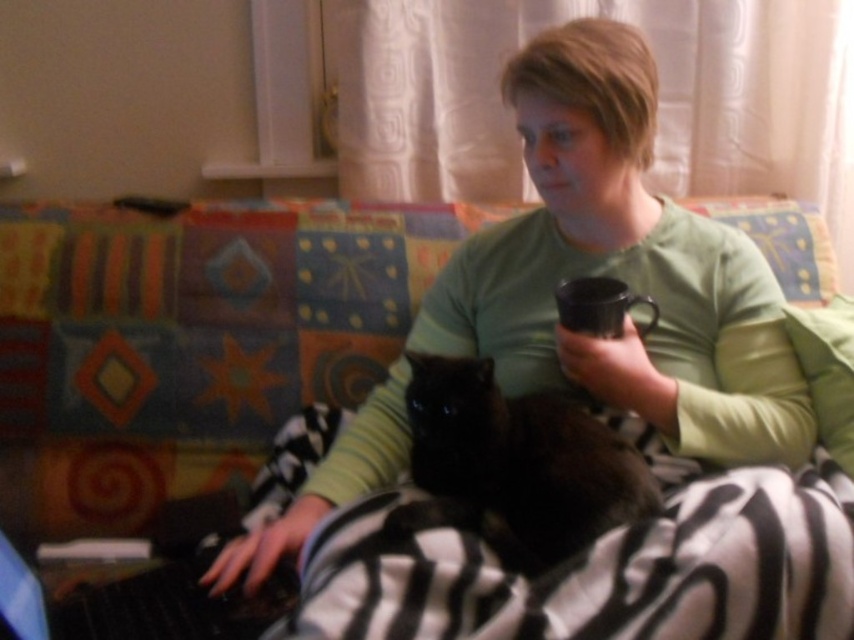
Measure the distance between green soft shirt at center and camera.

green soft shirt at center and camera are 36.29 inches apart from each other.

Based on the photo, can you confirm if green soft shirt at center is shorter than black fur cat at center?

No, green soft shirt at center is not shorter than black fur cat at center.

Describe the element at coordinates (619, 268) in the screenshot. I see `green soft shirt at center` at that location.

Where is `green soft shirt at center`? The height and width of the screenshot is (640, 854). green soft shirt at center is located at coordinates (619, 268).